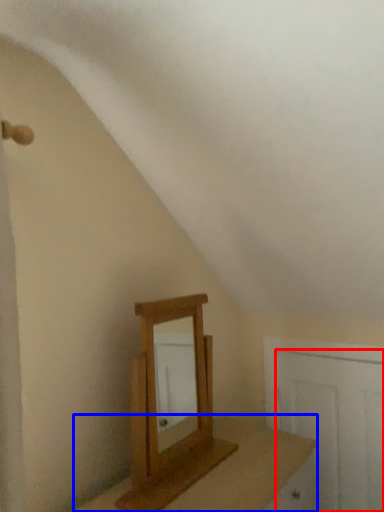
Question: Which object appears farthest to the camera in this image, door (highlighted by a red box) or table (highlighted by a blue box)?

Choices:
 (A) door
 (B) table

Answer: (A)